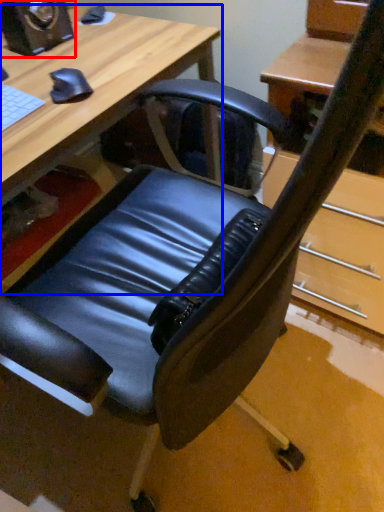
Question: Which object is closer to the camera taking this photo, speaker (highlighted by a red box) or desk (highlighted by a blue box)?

Choices:
 (A) speaker
 (B) desk

Answer: (B)